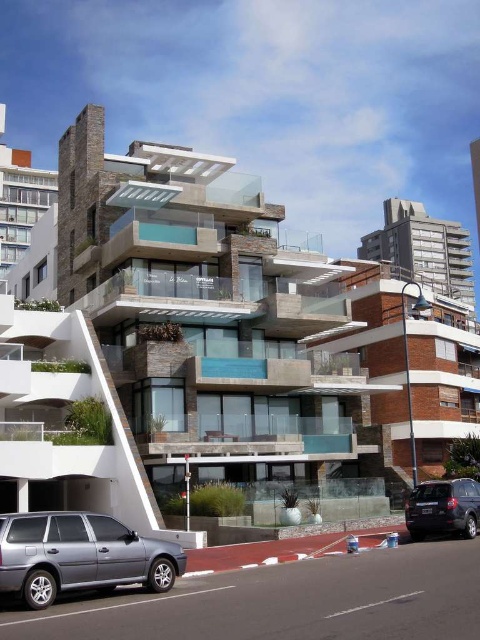
You are standing in front of the modern residential building and notice two points marked on the facade. The first point is located at coordinates point (x=54, y=541) and the second at point (x=460, y=512). From your perspective, which point appears closer to you?

Point (x=54, y=541) is in front of point (x=460, y=512), so it appears closer to you.

You are a pedestrian standing in front of the modern residential building. You see the silver metallic suv at lower left and the dark gray matte suv at lower right. Which SUV is nearer to you?

The silver metallic suv at lower left is closer to the viewer than the dark gray matte suv at lower right, so the silver metallic suv at lower left is nearer to you.